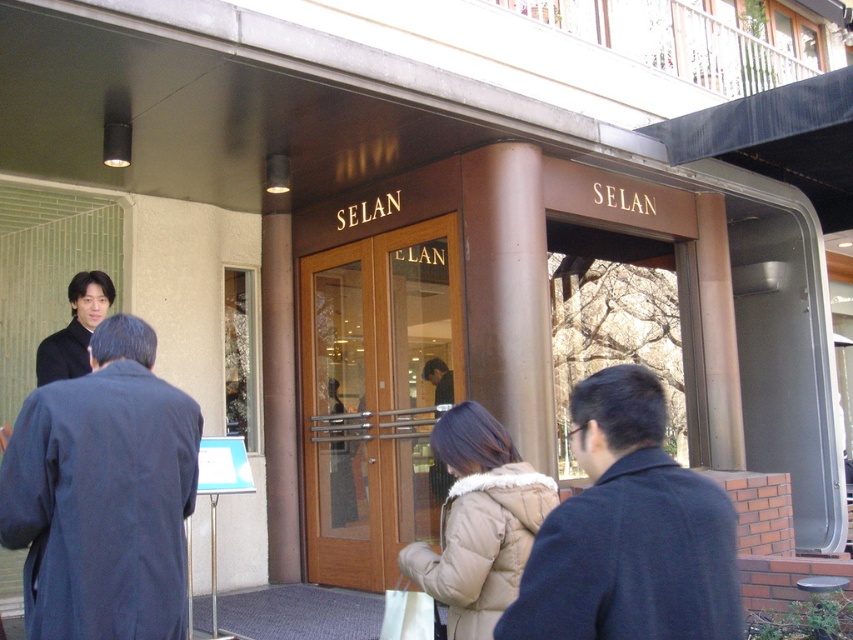
Where is `dark blue coat at left`? dark blue coat at left is located at coordinates (103, 493).

Is point (73, 420) closer to viewer compared to point (427, 589)?

Yes, point (73, 420) is closer to viewer.

At what (x,y) coordinates should I click in order to perform the action: click on dark blue coat at left. Please return your answer as a coordinate pair (x, y). Looking at the image, I should click on (103, 493).

Is dark blue coat at center behind matte black coat at center?

That is False.

Locate an element on the screen. The height and width of the screenshot is (640, 853). dark blue coat at center is located at coordinates (630, 532).

Can you confirm if dark blue coat at center is positioned below beige puffy coat at center?

No.

Does dark blue coat at center have a smaller size compared to beige puffy coat at center?

Yes.

Where is `dark blue coat at center`? The height and width of the screenshot is (640, 853). dark blue coat at center is located at coordinates (630, 532).